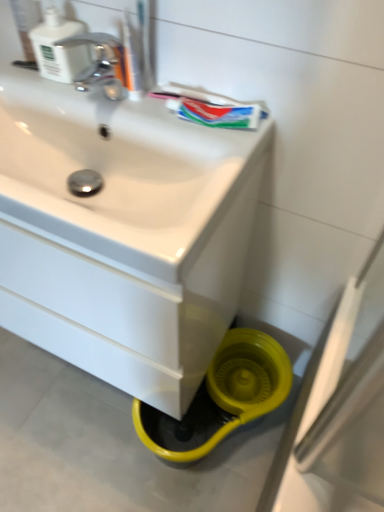
Locate an element on the screen. vacant space to the left of green matte toothpaste at upper center is located at coordinates (143, 112).